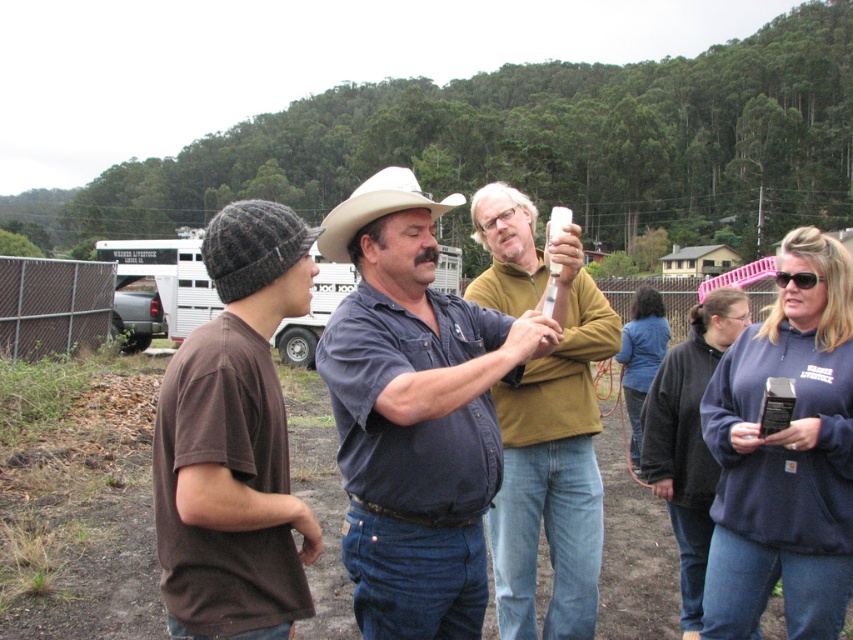
Question: Can you confirm if matte yellow shirt at center is positioned to the right of white matte cowboy hat at center?

Choices:
 (A) yes
 (B) no

Answer: (A)

Question: Which point is farther to the camera?

Choices:
 (A) matte yellow shirt at center
 (B) brown knit beanie at left
 (C) blue denim jeans at center
 (D) white matte cowboy hat at center

Answer: (A)

Question: Which object appears farthest from the camera in this image?

Choices:
 (A) blue denim jeans at center
 (B) white matte cowboy hat at center
 (C) matte yellow shirt at center
 (D) brown knit beanie at left

Answer: (C)

Question: Can you confirm if brown knit beanie at left is smaller than white matte cowboy hat at center?

Choices:
 (A) yes
 (B) no

Answer: (A)

Question: Which object appears closest to the camera in this image?

Choices:
 (A) matte yellow shirt at center
 (B) blue denim jeans at center
 (C) white matte cowboy hat at center
 (D) brown knit beanie at left

Answer: (D)

Question: Is blue denim jeans at center closer to the viewer compared to matte yellow shirt at center?

Choices:
 (A) no
 (B) yes

Answer: (B)